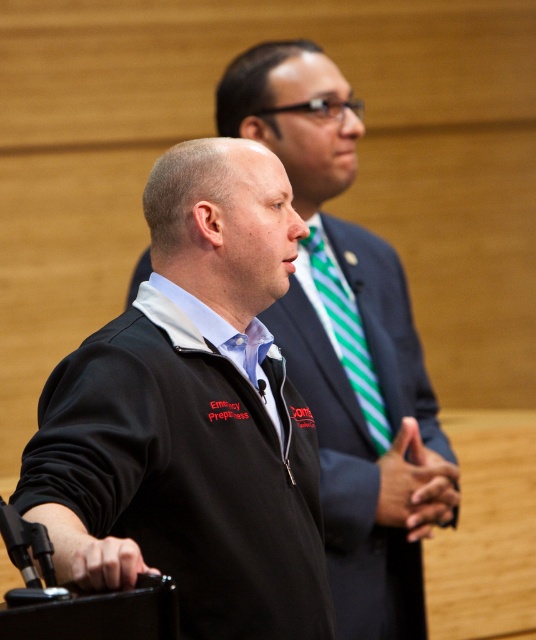
Question: Which of these objects is positioned closest to the green striped tie at center?

Choices:
 (A) dark blue suit at center
 (B) black matte jacket at center
 (C) black fleece jacket at center

Answer: (A)

Question: Is dark blue suit at center to the left of green striped tie at center from the viewer's perspective?

Choices:
 (A) no
 (B) yes

Answer: (A)

Question: Which point is closer to the camera?

Choices:
 (A) black matte jacket at center
 (B) green striped tie at center

Answer: (A)

Question: Which point is farther to the camera?

Choices:
 (A) (360, 392)
 (B) (55, 445)
 (C) (370, 436)

Answer: (A)

Question: In this image, where is black fleece jacket at center located relative to green striped tie at center?

Choices:
 (A) below
 (B) above

Answer: (A)

Question: Can you confirm if black fleece jacket at center is wider than green striped tie at center?

Choices:
 (A) no
 (B) yes

Answer: (B)